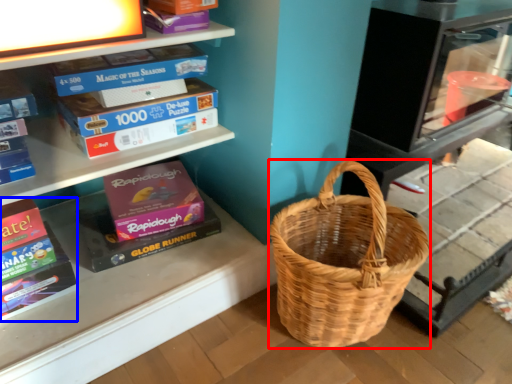
Question: Which object is further to the camera taking this photo, picnic basket (highlighted by a red box) or paperback book (highlighted by a blue box)?

Choices:
 (A) picnic basket
 (B) paperback book

Answer: (B)